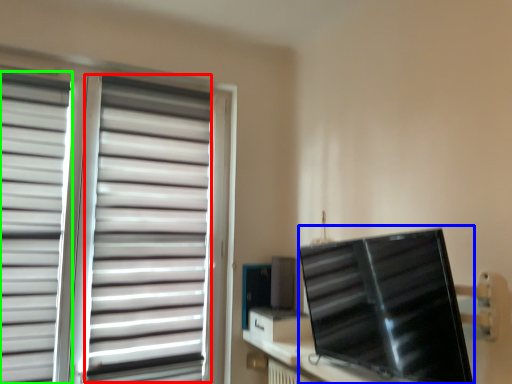
Question: Considering the real-world distances, which object is farthest from curtain (highlighted by a red box)? computer monitor (highlighted by a blue box) or curtain (highlighted by a green box)?

Choices:
 (A) computer monitor
 (B) curtain

Answer: (A)